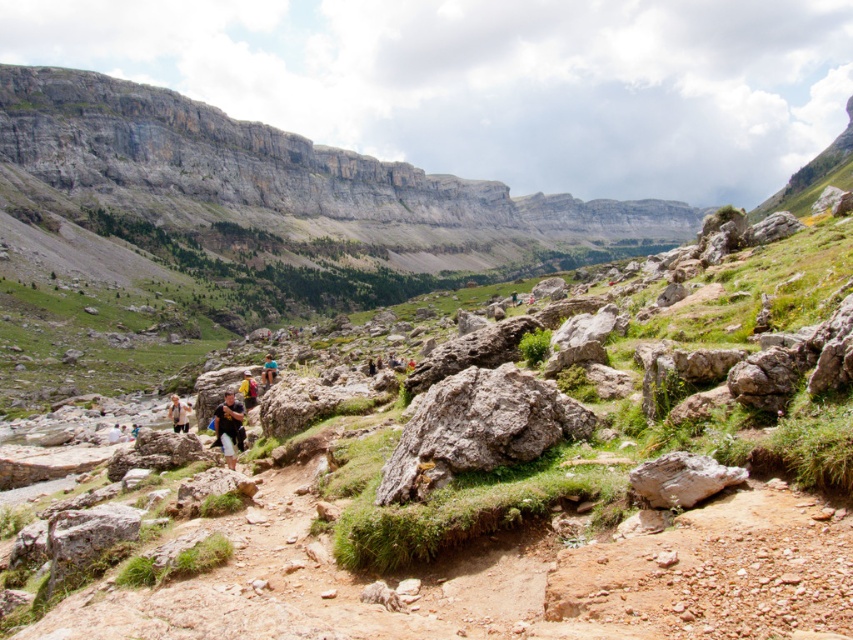
Question: Which point is farther to the camera?

Choices:
 (A) (119, 435)
 (B) (225, 458)
 (C) (183, 428)
 (D) (264, 368)

Answer: (D)

Question: In this image, where is matte black shorts at lower left located relative to blue fabric backpack at center?

Choices:
 (A) left
 (B) right

Answer: (A)

Question: Among these points, which one is farthest from the camera?

Choices:
 (A) (265, 360)
 (B) (242, 374)

Answer: (A)

Question: Among these points, which one is farthest from the camera?

Choices:
 (A) (175, 404)
 (B) (686, 461)

Answer: (A)

Question: Can you confirm if dark blue fabric backpack at center is wider than matte black shorts at lower left?

Choices:
 (A) yes
 (B) no

Answer: (B)

Question: Can you confirm if dark blue fabric backpack at center is positioned above matte black shorts at lower left?

Choices:
 (A) yes
 (B) no

Answer: (A)